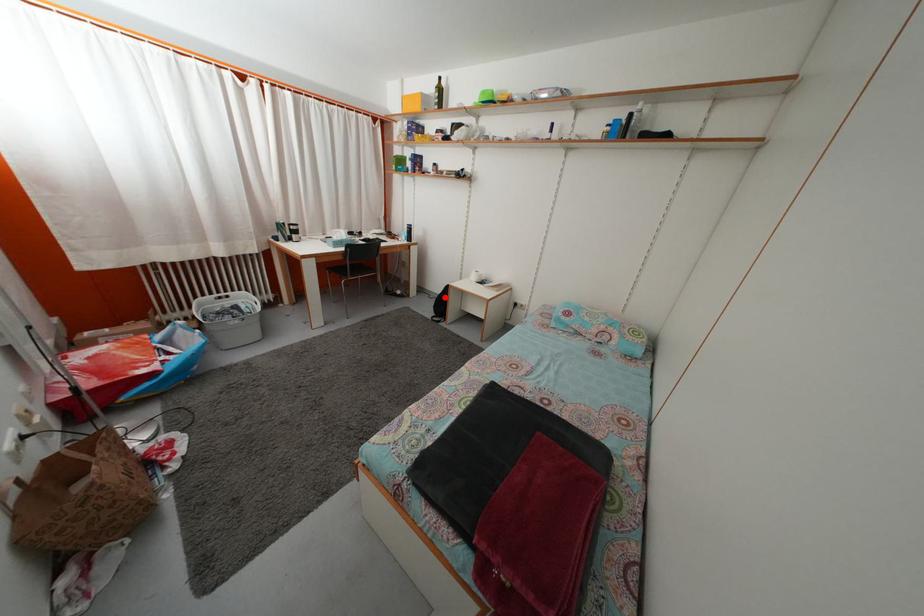
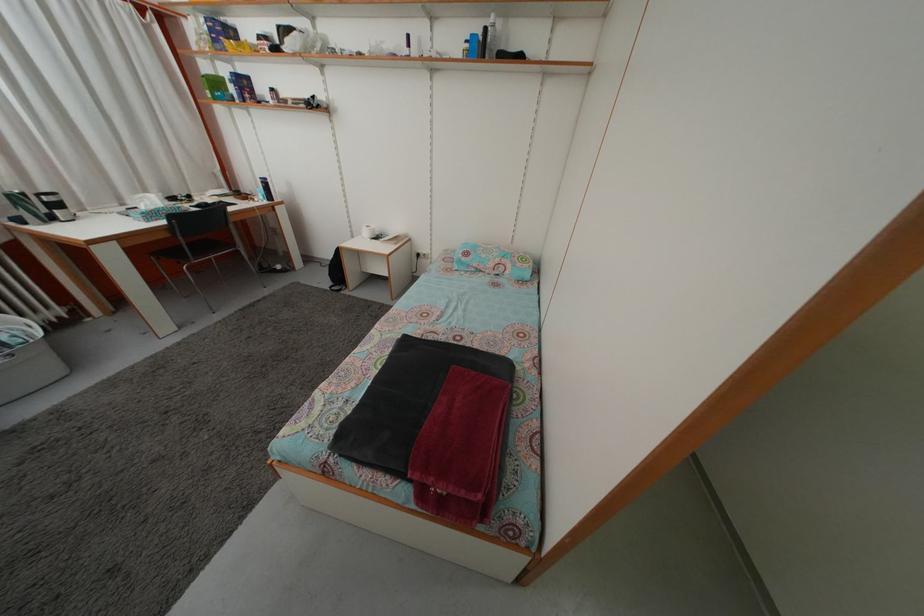
Question: I am providing you with two images of the same scene from different viewpoints. Image1 has a red point marked. In image2, the corresponding 3D location appears at what relative position? Reply with the corresponding letter.

Choices:
 (A) Closer
 (B) Farther

Answer: (B)